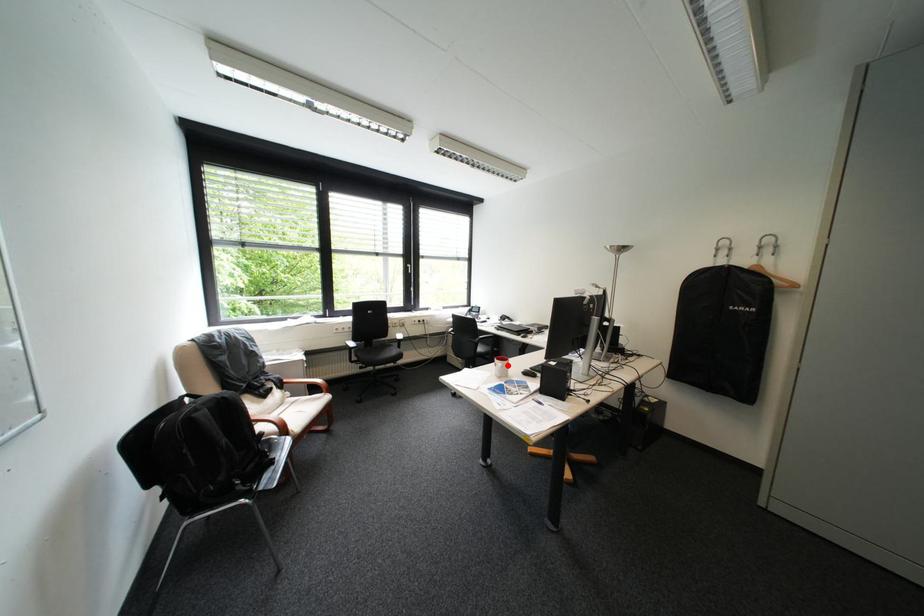
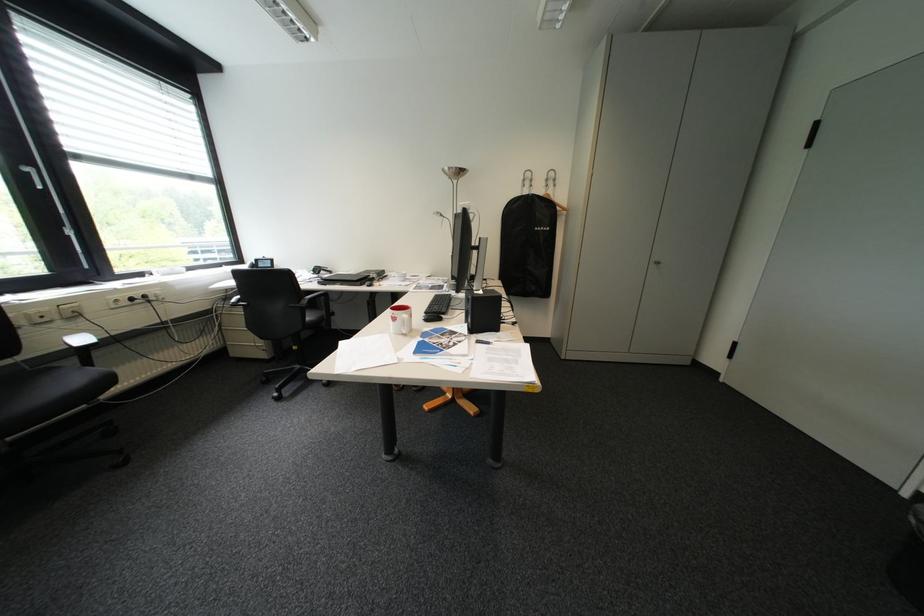
The point at the highlighted location is marked in the first image. Where is the corresponding point in the second image?

(407, 320)